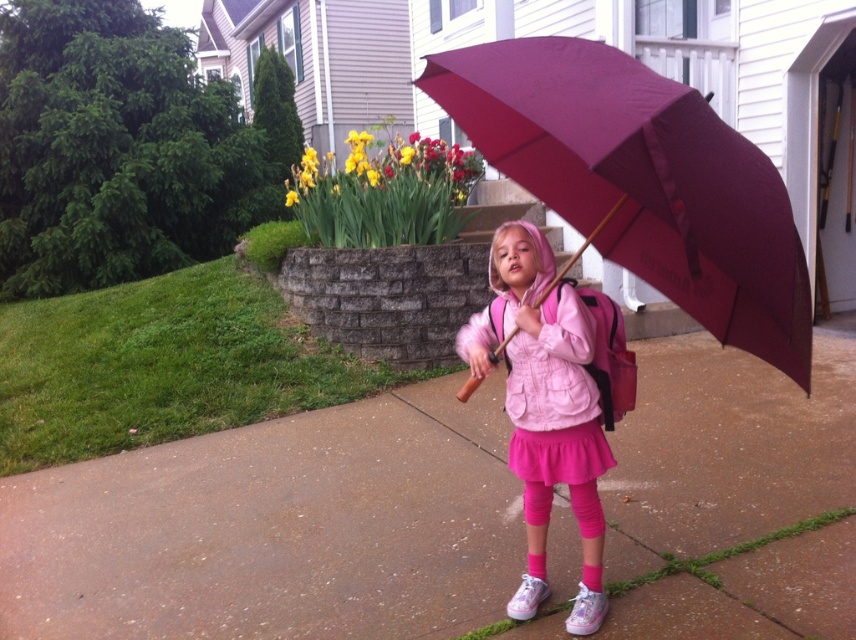
Does pink fleece jacket at center lie behind yellow matte daffodil at upper center?

No.

Is pink fleece jacket at center to the left of yellow matte daffodil at upper center from the viewer's perspective?

In fact, pink fleece jacket at center is to the right of yellow matte daffodil at upper center.

Is point (581, 508) behind point (361, 144)?

No, it is in front of (361, 144).

Where is `pink fleece jacket at center`? This screenshot has width=856, height=640. pink fleece jacket at center is located at coordinates (545, 410).

Is burgundy fabric umbrella at center wider than yellow matte daffodil at upper center?

Correct, the width of burgundy fabric umbrella at center exceeds that of yellow matte daffodil at upper center.

Image resolution: width=856 pixels, height=640 pixels. I want to click on burgundy fabric umbrella at center, so click(642, 180).

Is burgundy fabric umbrella at center to the right of pink fleece jacket at center from the viewer's perspective?

Yes, burgundy fabric umbrella at center is to the right of pink fleece jacket at center.

From the picture: Is burgundy fabric umbrella at center in front of pink fleece jacket at center?

Yes, it is.

Image resolution: width=856 pixels, height=640 pixels. I want to click on burgundy fabric umbrella at center, so click(642, 180).

The image size is (856, 640). Identify the location of burgundy fabric umbrella at center. (642, 180).